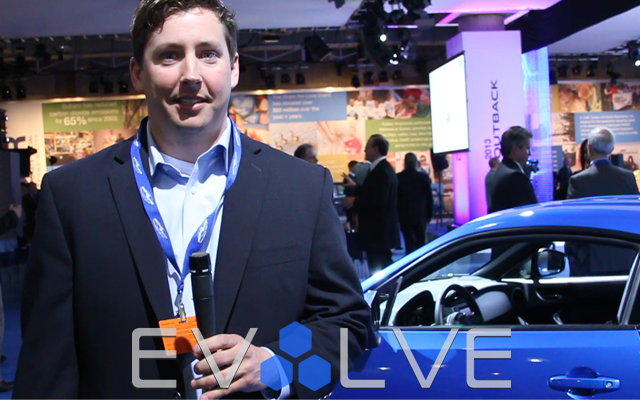
The width and height of the screenshot is (640, 400). I want to click on ceiling, so click(x=90, y=16), click(x=269, y=17).